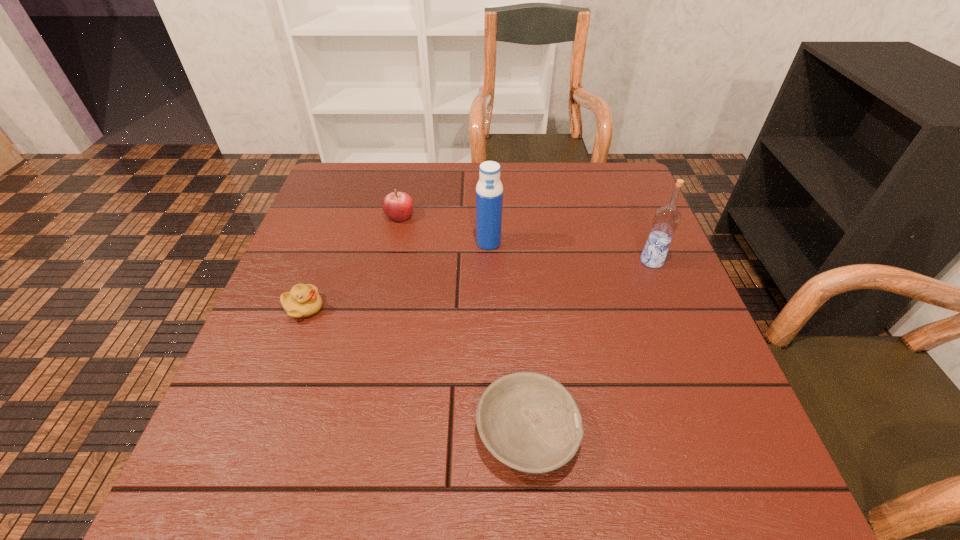
I want to click on vacant point at the left edge, so 278,306.

Identify the location of free space at the right edge of the desktop. The image size is (960, 540). (664, 277).

Identify the location of vacant region at the far left corner of the desktop. (341, 168).

Find the location of a particular element. This screenshot has height=540, width=960. vacant region at the far right corner of the desktop is located at coordinates coord(606,198).

Image resolution: width=960 pixels, height=540 pixels. In order to click on free area in between the farthest object and the leftmost object in this screenshot , I will do `click(351, 262)`.

You are a GUI agent. You are given a task and a screenshot of the screen. Output one action in this format:
    pyautogui.click(x=<x>, y=<y>)
    Task: Click on the vacant area that lies between the duckling and the fourth object from right to left
    The image size is (960, 540).
    Given the screenshot: What is the action you would take?
    [x=351, y=262]

Identify the location of vacant point located between the second farthest object and the apple. (444, 229).

The width and height of the screenshot is (960, 540). Identify the location of free space that is in between the fourth object from right to left and the nearest object. 463,324.

Locate an element on the screen. This screenshot has height=540, width=960. vacant area that lies between the second farthest object and the duckling is located at coordinates (396, 275).

What are the coordinates of `free space between the second nearest object and the water bottle` in the screenshot? It's located at click(x=396, y=275).